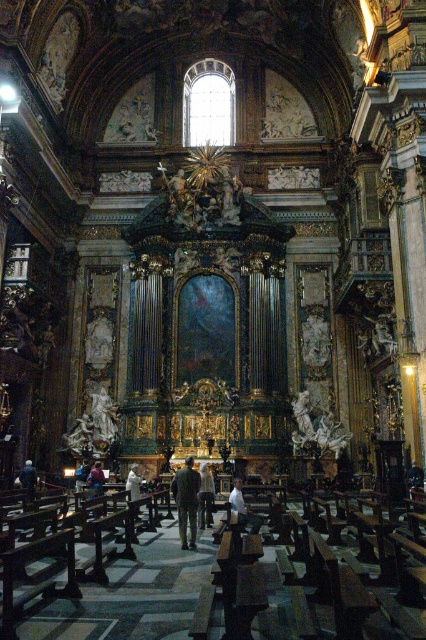
You are an interior designer planning to place a 1.2 meter wide decorative item in the church. You see the light beige fabric coat at center and the blue fabric person at center. Which object can the item fit next to without overlapping?

The light beige fabric coat at center has a width of less than the blue fabric person at center. Since the decorative item is 1.2 meters wide, it can fit next to the blue fabric person at center as it is wider than the coat.